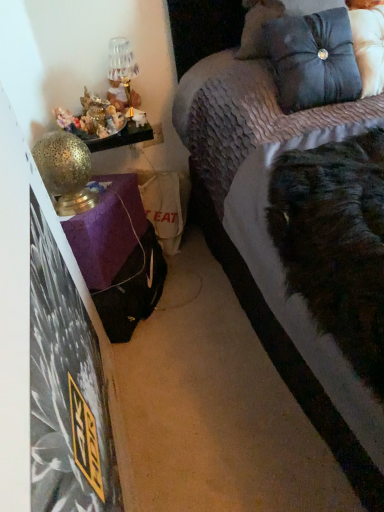
Question: From a real-world perspective, is shiny metallic figurines at left over metallic gold table lamp at upper left, arranged as the first table lamp when viewed from the back?

Choices:
 (A) yes
 (B) no

Answer: (B)

Question: Does shiny metallic figurines at left have a greater width compared to metallic gold table lamp at upper left, arranged as the second table lamp when viewed from the front?

Choices:
 (A) no
 (B) yes

Answer: (B)

Question: Is metallic gold table lamp at upper left, which is the 2th table lamp from bottom to top, inside shiny metallic figurines at left?

Choices:
 (A) no
 (B) yes

Answer: (A)

Question: Considering the relative positions of shiny metallic figurines at left and metallic gold table lamp at upper left, which is the 2th table lamp from bottom to top, in the image provided, is shiny metallic figurines at left behind metallic gold table lamp at upper left, which is the 2th table lamp from bottom to top,?

Choices:
 (A) no
 (B) yes

Answer: (A)

Question: Considering the relative sizes of shiny metallic figurines at left and metallic gold table lamp at upper left, arranged as the first table lamp when viewed from the back, in the image provided, is shiny metallic figurines at left smaller than metallic gold table lamp at upper left, arranged as the first table lamp when viewed from the back,?

Choices:
 (A) yes
 (B) no

Answer: (B)

Question: From a real-world perspective, relative to gold textured table lamp at left, arranged as the 2th table lamp when viewed from the top, is satin blue pillow at upper right vertically above or below?

Choices:
 (A) below
 (B) above

Answer: (B)

Question: Would you say satin blue pillow at upper right is inside or outside gold textured table lamp at left, arranged as the 2th table lamp when viewed from the top?

Choices:
 (A) outside
 (B) inside

Answer: (A)

Question: Is point pyautogui.click(x=334, y=102) closer or farther from the camera than point pyautogui.click(x=54, y=205)?

Choices:
 (A) closer
 (B) farther

Answer: (B)

Question: In the image, is satin blue pillow at upper right positioned in front of or behind gold textured table lamp at left, which is counted as the first table lamp, starting from the bottom?

Choices:
 (A) behind
 (B) front

Answer: (B)

Question: Is point (312, 84) closer or farther from the camera than point (69, 117)?

Choices:
 (A) farther
 (B) closer

Answer: (B)

Question: Do you think satin blue pillow at upper right is within shiny metallic figurines at left, or outside of it?

Choices:
 (A) inside
 (B) outside

Answer: (B)

Question: Is satin blue pillow at upper right in front of or behind shiny metallic figurines at left in the image?

Choices:
 (A) behind
 (B) front

Answer: (B)

Question: Based on their sizes in the image, would you say satin blue pillow at upper right is bigger or smaller than shiny metallic figurines at left?

Choices:
 (A) small
 (B) big

Answer: (B)

Question: From their relative heights in the image, would you say gold textured table lamp at left, arranged as the 2th table lamp when viewed from the top, is taller or shorter than satin blue pillow at upper right?

Choices:
 (A) short
 (B) tall

Answer: (A)

Question: Looking at the image, does gold textured table lamp at left, which is counted as the first table lamp, starting from the bottom, seem bigger or smaller compared to satin blue pillow at upper right?

Choices:
 (A) big
 (B) small

Answer: (B)